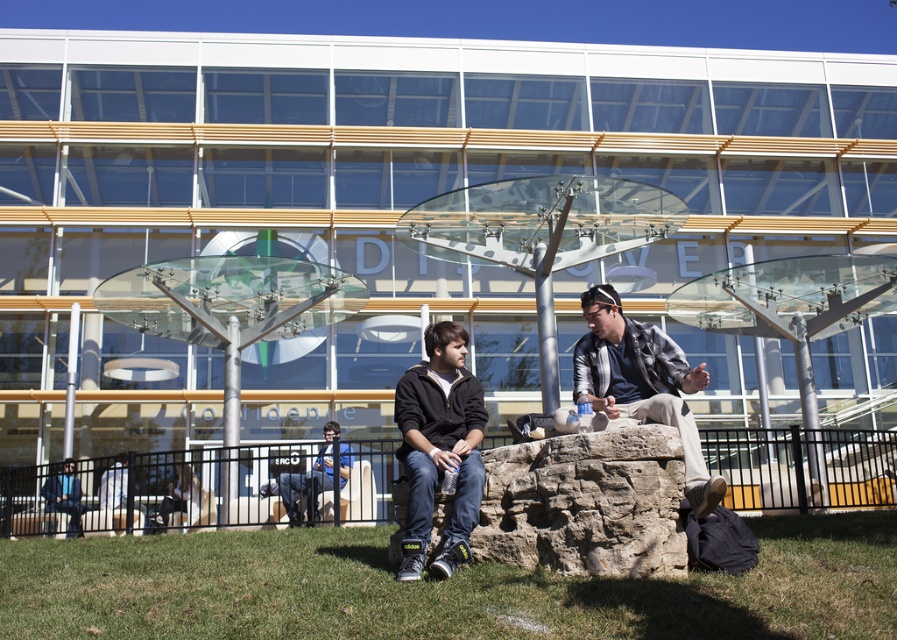
Question: Which of these objects is positioned closest to the black matte jacket at center?

Choices:
 (A) brown rough stone at center
 (B) plaid fabric jacket at center
 (C) green grass at lower center
 (D) blue denim jeans at center

Answer: (A)

Question: Estimate the real-world distances between objects in this image. Which object is farther from the brown rough stone at center?

Choices:
 (A) green grass at lower center
 (B) plaid fabric jacket at center
 (C) black matte jacket at center

Answer: (A)

Question: Does brown rough stone at center appear on the left side of plaid fabric jacket at center?

Choices:
 (A) no
 (B) yes

Answer: (B)

Question: Estimate the real-world distances between objects in this image. Which object is closer to the black matte jacket at center?

Choices:
 (A) green grass at lower center
 (B) brown rough stone at center
 (C) plaid fabric jacket at center
 (D) blue denim jeans at center

Answer: (B)

Question: Is green grass at lower center bigger than black matte jacket at center?

Choices:
 (A) no
 (B) yes

Answer: (A)

Question: Does brown rough stone at center appear under black matte jacket at center?

Choices:
 (A) yes
 (B) no

Answer: (A)